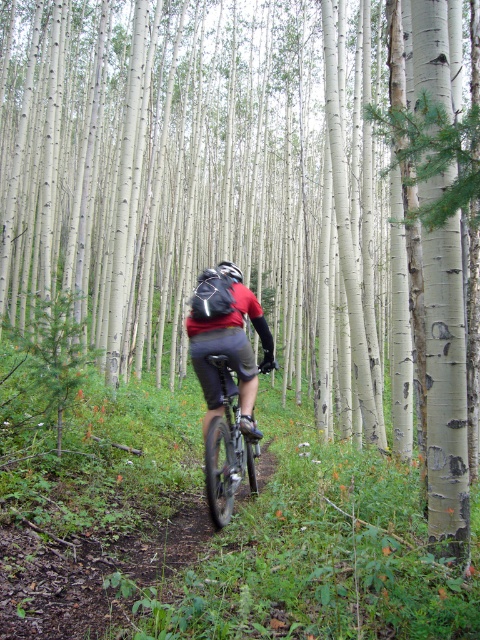
Question: Can you confirm if matte black helmet at center is smaller than shiny silver helmet at center?

Choices:
 (A) no
 (B) yes

Answer: (B)

Question: Which object is closer to the camera taking this photo?

Choices:
 (A) shiny metallic bicycle at center
 (B) shiny silver helmet at center

Answer: (A)

Question: Can you confirm if matte black helmet at center is wider than shiny metallic bicycle at center?

Choices:
 (A) yes
 (B) no

Answer: (A)

Question: Which of the following is the farthest from the observer?

Choices:
 (A) shiny silver helmet at center
 (B) matte black helmet at center

Answer: (A)

Question: Which of these objects is positioned closest to the shiny silver helmet at center?

Choices:
 (A) matte black helmet at center
 (B) shiny metallic bicycle at center

Answer: (A)

Question: Considering the relative positions of matte black helmet at center and shiny silver helmet at center in the image provided, where is matte black helmet at center located with respect to shiny silver helmet at center?

Choices:
 (A) above
 (B) below

Answer: (B)